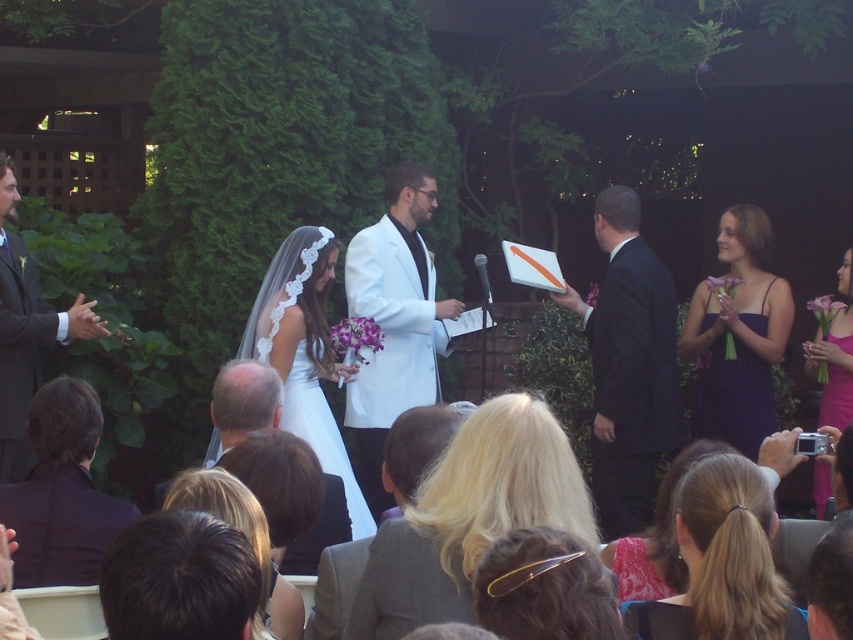
Question: Estimate the real-world distances between objects in this image. Which object is farther from the floral lace dress at center?

Choices:
 (A) pink satin dress at lower right
 (B) dark brown hair at lower left
 (C) purple satin dress at right
 (D) black suit at right

Answer: (A)

Question: Can you confirm if blonde hair at center is positioned to the right of floral lace dress at center?

Choices:
 (A) yes
 (B) no

Answer: (B)

Question: Is matte black suit at left above floral lace dress at center?

Choices:
 (A) no
 (B) yes

Answer: (B)

Question: Can you confirm if blonde hair at lower right is positioned above pink satin dress at lower right?

Choices:
 (A) no
 (B) yes

Answer: (A)

Question: Which point is farther to the camera?

Choices:
 (A) (0, 230)
 (B) (630, 372)
 (C) (403, 355)

Answer: (C)

Question: Among these points, which one is nearest to the camera?

Choices:
 (A) (20, 406)
 (B) (61, 420)
 (C) (648, 564)
 (D) (393, 499)

Answer: (C)